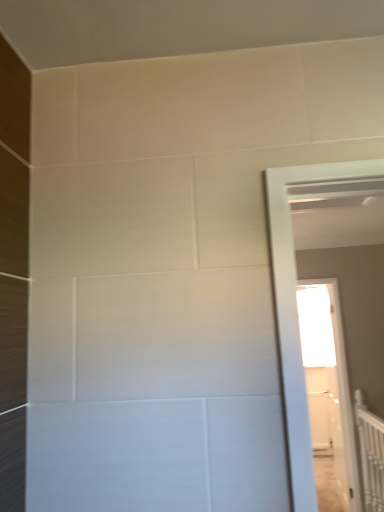
Measure the distance between white textured rail at right and camera.

Answer: white textured rail at right and camera are 10.05 feet apart from each other.

Find the location of a particular element. The height and width of the screenshot is (512, 384). white textured rail at right is located at coordinates (371, 454).

What do you see at coordinates (371, 454) in the screenshot? I see `white textured rail at right` at bounding box center [371, 454].

Find the location of `white textured rail at right`. white textured rail at right is located at coordinates (371, 454).